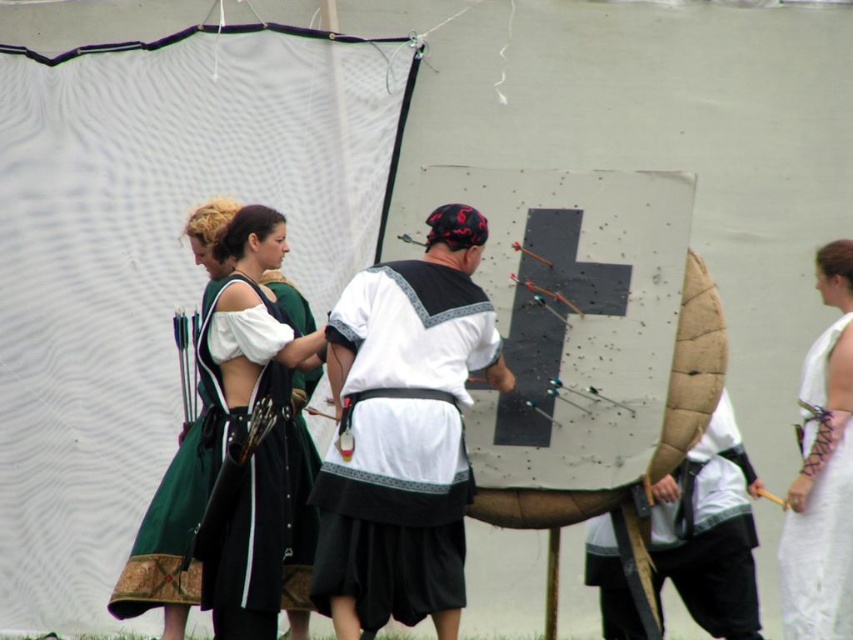
Is the position of white cotton shirt at center less distant than that of white lace cloth at right?

Yes, it is in front of white lace cloth at right.

Is point (361, 342) in front of point (830, 406)?

That is True.

Image resolution: width=853 pixels, height=640 pixels. What do you see at coordinates (403, 433) in the screenshot?
I see `white cotton shirt at center` at bounding box center [403, 433].

Locate an element on the screen. white cotton shirt at center is located at coordinates (403, 433).

Between white cotton shirt at center and green velvet dress at center, which one has more height?

green velvet dress at center

Which is behind, point (351, 444) or point (312, 452)?

Point (312, 452)

Which is in front, point (397, 336) or point (293, 577)?

Point (397, 336) is more forward.

The width and height of the screenshot is (853, 640). I want to click on white cotton shirt at center, so click(x=403, y=433).

Is green velvet dress at center thinner than white lace cloth at right?

Incorrect, green velvet dress at center's width is not less than white lace cloth at right's.

Where is `green velvet dress at center`? green velvet dress at center is located at coordinates (167, 541).